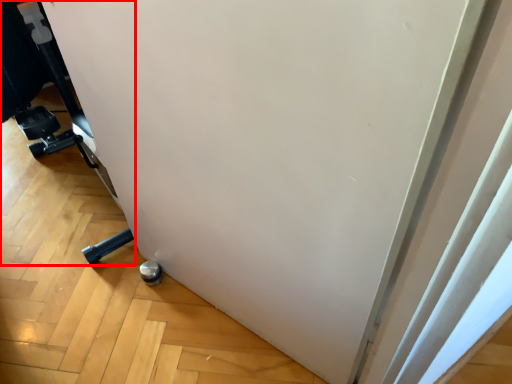
Question: From the image's perspective, what is the correct spatial relationship of furniture (annotated by the red box) in relation to wheel?

Choices:
 (A) below
 (B) above

Answer: (B)